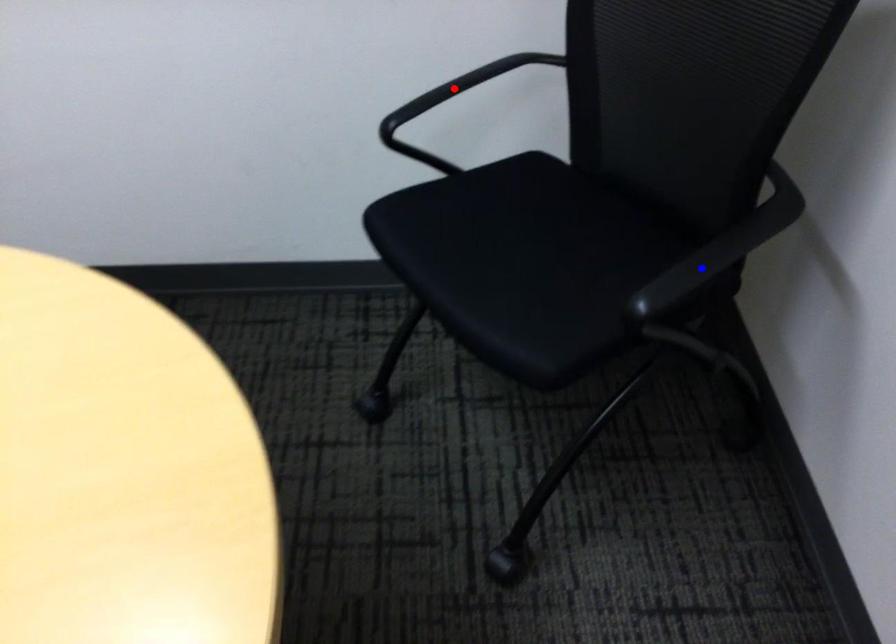
Question: Two points are marked on the image. Which point is closer to the camera?

Choices:
 (A) Blue point is closer.
 (B) Red point is closer.

Answer: (A)